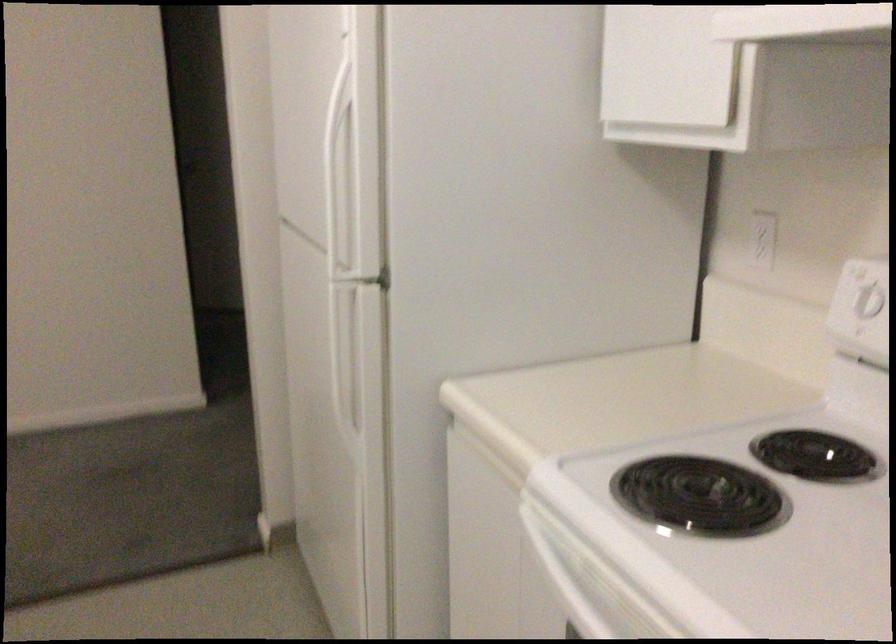
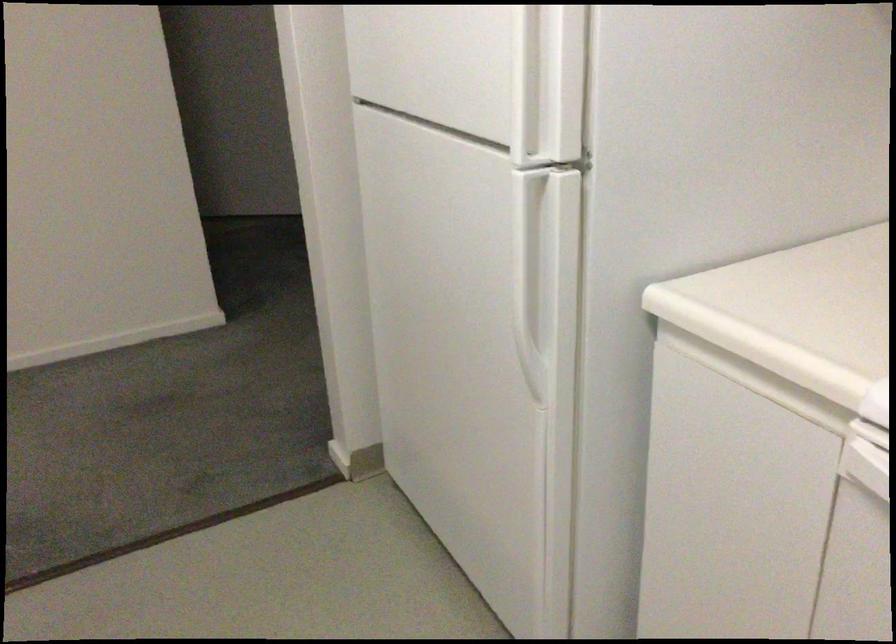
Question: Based on the continuous images, in which direction is the camera rotating? Reply with the corresponding letter.

Choices:
 (A) Left
 (B) Right
 (C) Up
 (D) Down

Answer: (D)